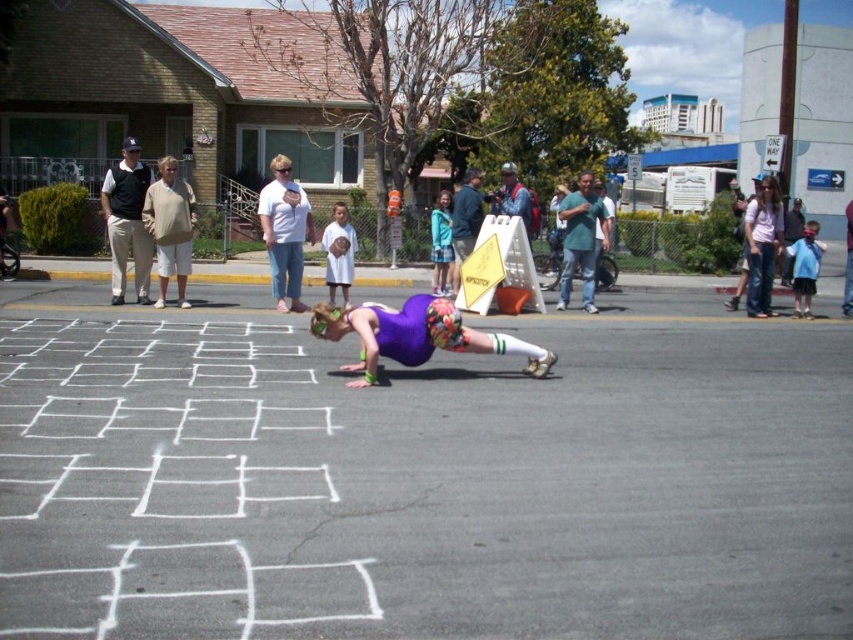
Question: Which point is farther to the camera?

Choices:
 (A) green t-shirt at center
 (B) white cotton shirt at center
 (C) purple fabric squat at center

Answer: (A)

Question: Which object is the farthest from the matte khaki pants at left?

Choices:
 (A) green t-shirt at center
 (B) beige cotton shirt at left

Answer: (A)

Question: Is white cotton shirt at center to the right of green t-shirt at center from the viewer's perspective?

Choices:
 (A) no
 (B) yes

Answer: (A)

Question: Does purple fabric squat at center appear on the right side of white cotton shirt at center?

Choices:
 (A) yes
 (B) no

Answer: (A)

Question: Can you confirm if purple fabric squat at center is positioned above white cotton dress at center?

Choices:
 (A) yes
 (B) no

Answer: (B)

Question: Which point is farther to the camera?

Choices:
 (A) purple fabric squat at center
 (B) matte khaki pants at left
 (C) green t-shirt at center

Answer: (C)